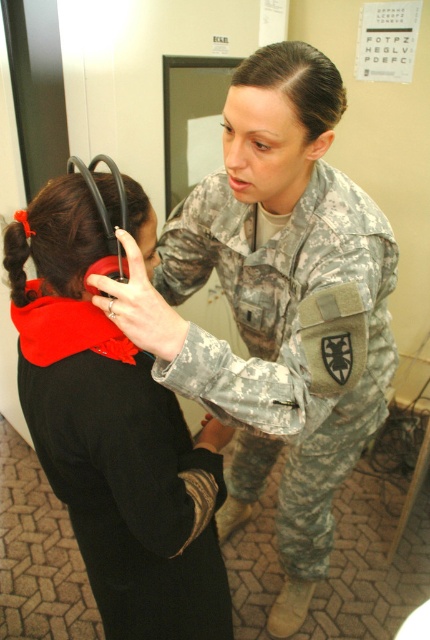
Which is behind, point (86, 372) or point (282, 77)?

Positioned behind is point (282, 77).

Where is `red matte ear protection at upper left`? Image resolution: width=430 pixels, height=640 pixels. red matte ear protection at upper left is located at coordinates pyautogui.click(x=119, y=448).

Does point (98, 401) come closer to viewer compared to point (301, 83)?

Yes, it is.

Image resolution: width=430 pixels, height=640 pixels. What are the coordinates of `red matte ear protection at upper left` in the screenshot? It's located at [x=119, y=448].

Is red matte ear protection at upper left below camouflage fabric uniform at center?

No, red matte ear protection at upper left is not below camouflage fabric uniform at center.

Is point (181, 452) positioned before point (356, 220)?

No.

The height and width of the screenshot is (640, 430). What are the coordinates of `red matte ear protection at upper left` in the screenshot? It's located at (119, 448).

Who is more distant from viewer, (x=269, y=445) or (x=254, y=81)?

Point (x=269, y=445)

Is point (251, 406) positioned behind point (312, 99)?

No, (251, 406) is in front of (312, 99).

This screenshot has height=640, width=430. Find the location of `camouflage fabric uniform at center`. camouflage fabric uniform at center is located at coordinates (285, 342).